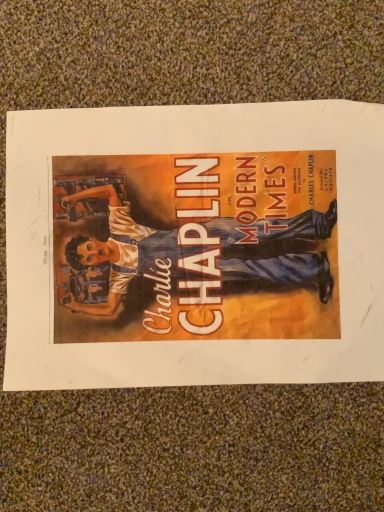
Find the location of a particular element. This screenshot has height=512, width=384. free space above matte paper poster at center (from a real-world perspective) is located at coordinates (196, 249).